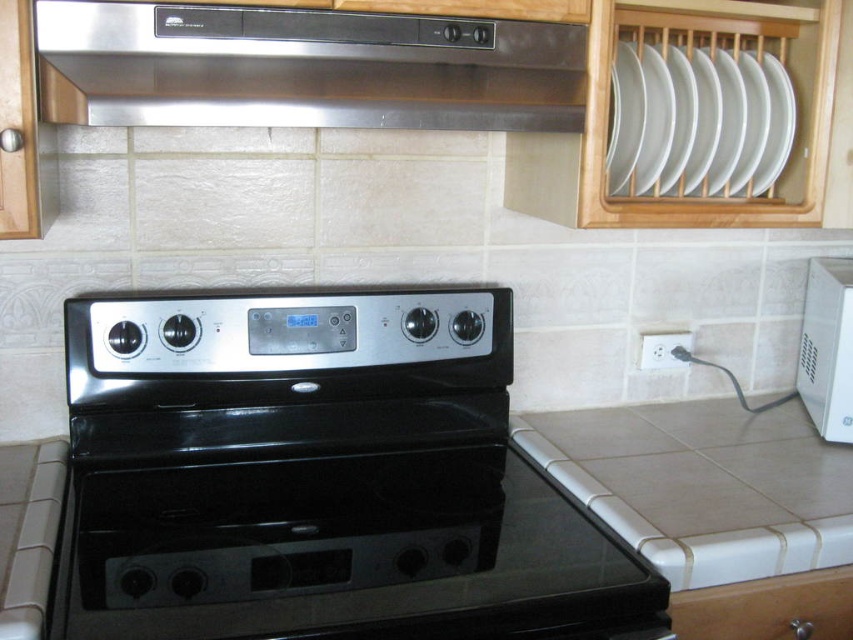
Question: Which of the following is the farthest from the observer?

Choices:
 (A) white glossy microwave at right
 (B) white glossy plate at upper right
 (C) stainless steel exhaust hood at upper center
 (D) black glossy oven at center

Answer: (A)

Question: Can you confirm if stainless steel exhaust hood at upper center is positioned above white glossy microwave at right?

Choices:
 (A) no
 (B) yes

Answer: (B)

Question: Which point is closer to the camera taking this photo?

Choices:
 (A) (814, 403)
 (B) (770, 557)

Answer: (B)

Question: Does black glossy oven at center have a greater width compared to stainless steel exhaust hood at upper center?

Choices:
 (A) yes
 (B) no

Answer: (A)

Question: Among these objects, which one is nearest to the camera?

Choices:
 (A) stainless steel exhaust hood at upper center
 (B) white tile countertop at lower right
 (C) white glossy plate at upper right

Answer: (A)

Question: Can you confirm if black glossy oven at center is positioned to the right of white glossy microwave at right?

Choices:
 (A) no
 (B) yes

Answer: (A)